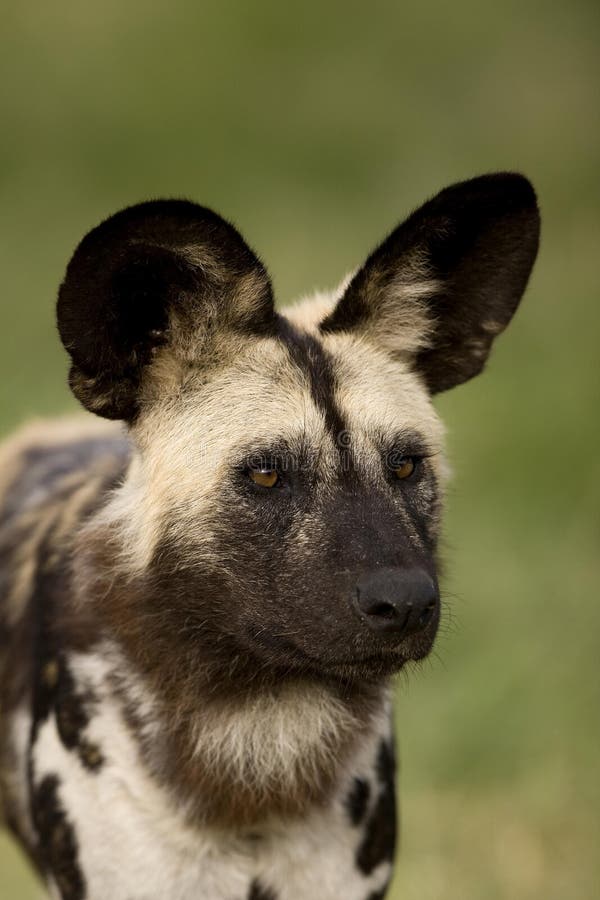
The width and height of the screenshot is (600, 900). Find the location of `chest`. chest is located at coordinates (256, 886).